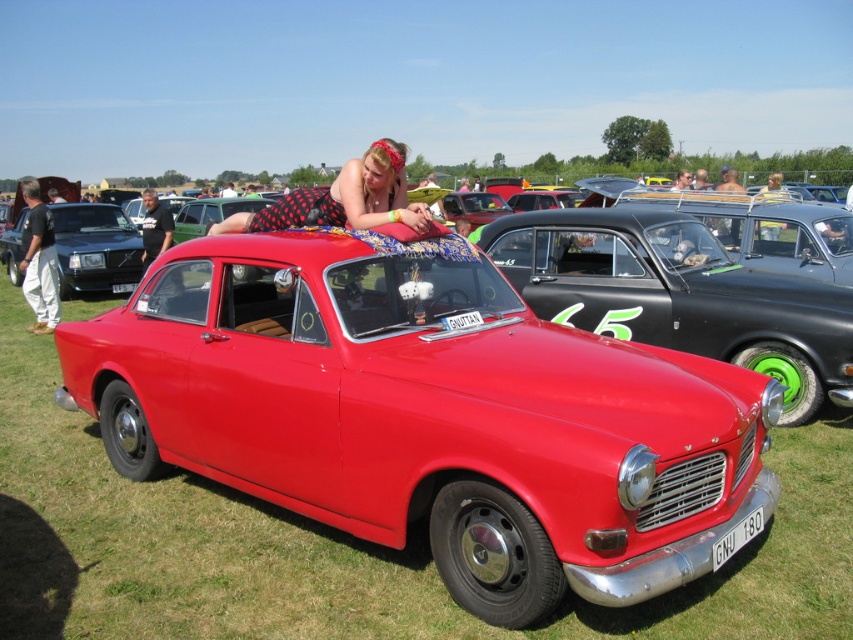
Which of these two, shiny red car at center or polka dot fabric at center, stands shorter?

polka dot fabric at center is shorter.

Is point (664, 237) positioned before point (311, 188)?

No.

Is point (502, 241) less distant than point (395, 150)?

No.

Locate an element on the screen. The height and width of the screenshot is (640, 853). shiny red car at center is located at coordinates (683, 296).

Who is positioned more to the left, polka dot fabric at center or shiny black car at left?

Positioned to the left is shiny black car at left.

In the scene shown: Is polka dot fabric at center to the right of shiny black car at left from the viewer's perspective?

Yes, polka dot fabric at center is to the right of shiny black car at left.

Which is in front, point (378, 148) or point (122, 257)?

Point (378, 148) is more forward.

I want to click on polka dot fabric at center, so click(x=341, y=198).

Between green grass at center and polka dot fabric at center, which one is positioned higher?

Positioned higher is polka dot fabric at center.

This screenshot has height=640, width=853. I want to click on green grass at center, so click(335, 547).

Find the location of a particular element. The height and width of the screenshot is (640, 853). green grass at center is located at coordinates (335, 547).